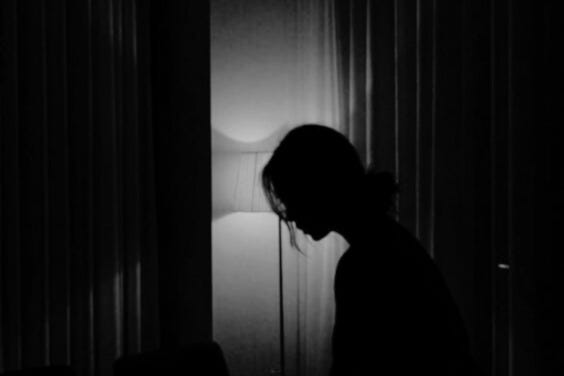
Identify the location of glow from lamp. The width and height of the screenshot is (564, 376). pos(239,122), pos(246,225).